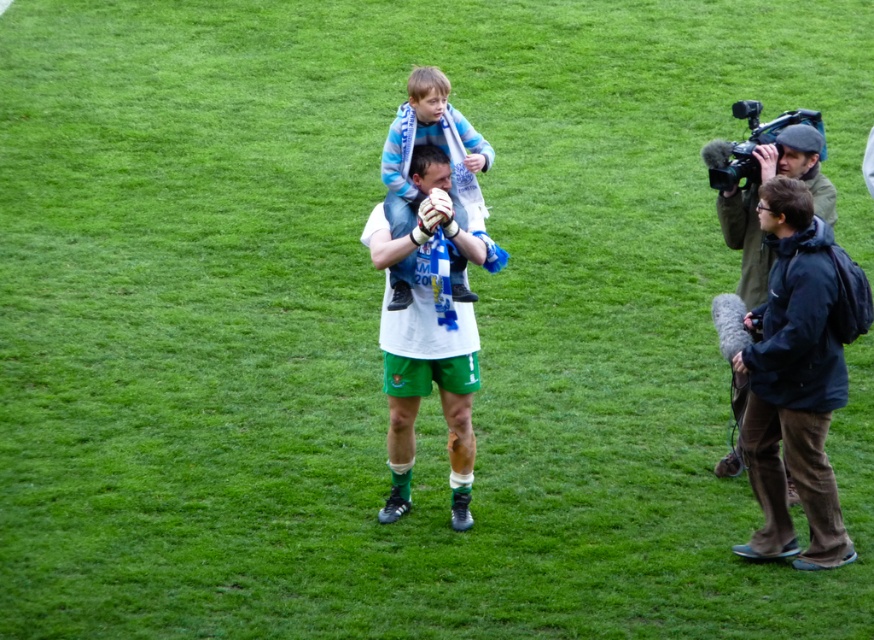
You are a photographer positioned at the edge of the field. You want to take a photo that includes both the white fabric shirt at center and the blue striped scarf at center. Given that your camera has a maximum zoom range of 15 inches, will you need to zoom in or can you capture both without zooming?

The distance between the white fabric shirt at center and the blue striped scarf at center is 18.13 inches. Since your camera can only zoom up to 15 inches, you will need to zoom in to capture both in the frame.

You are a photographer at the event. You need to take a photo that includes both the white fabric shirt at center and the dark green jacket at right. Based on their positions, which one should you focus on first to ensure both are in frame?

The white fabric shirt at center should be focused on first since it is in front of the dark green jacket at right, so adjusting the camera angle to include the foreground subject ensures the background one is also captured.

You are standing at the point labeled as point (831, 184) and want to walk to the point labeled as point (414, 346). Which direction should you move in to get closer to your destination?

You should move towards the camera because point (414, 346) is closer to the camera than point (831, 184).